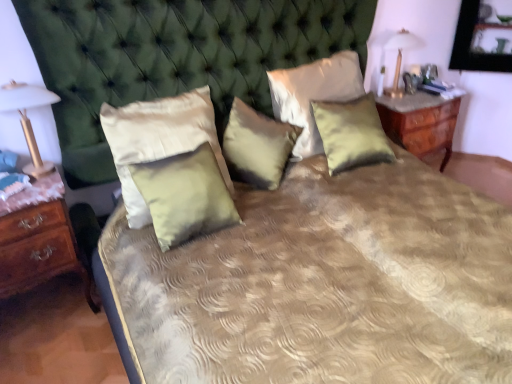
Measure the distance between point [25,167] and camera.

Point [25,167] is 1.88 meters from camera.

Describe the element at coordinates (185, 195) in the screenshot. I see `satin green pillow at center, placed as the 2th pillow when sorted from left to right` at that location.

Find the location of a particular element. satin green pillow at center, which is counted as the second pillow, starting from the right is located at coordinates (313, 94).

In order to click on satin yellow pillow at center, which appears as the 5th pillow when viewed from the left in this screenshot , I will do `click(351, 133)`.

Where is `wooden nightstand at right, marked as the 1th nightstand in a top-to-bottom arrangement`? This screenshot has height=384, width=512. wooden nightstand at right, marked as the 1th nightstand in a top-to-bottom arrangement is located at coordinates (420, 123).

Is gold metallic lampshade at left, the second bedside lamp when ordered from right to left, placed right next to gold metallic lampshade at upper right, which is counted as the second bedside lamp, starting from the bottom?

No, gold metallic lampshade at left, the second bedside lamp when ordered from right to left, is not touching gold metallic lampshade at upper right, which is counted as the second bedside lamp, starting from the bottom.

Considering the sizes of objects gold metallic lampshade at left, acting as the first bedside lamp starting from the left, and gold metallic lampshade at upper right, placed as the 2th bedside lamp when sorted from front to back, in the image provided, who is shorter, gold metallic lampshade at left, acting as the first bedside lamp starting from the left, or gold metallic lampshade at upper right, placed as the 2th bedside lamp when sorted from front to back,?

gold metallic lampshade at left, acting as the first bedside lamp starting from the left, is shorter.

From a real-world perspective, is gold metallic lampshade at left, which appears as the second bedside lamp when viewed from the back, over gold metallic lampshade at upper right, which is the 1th bedside lamp from top to bottom?

Indeed, from a real-world perspective, gold metallic lampshade at left, which appears as the second bedside lamp when viewed from the back, stands above gold metallic lampshade at upper right, which is the 1th bedside lamp from top to bottom.

Which object is positioned more to the right, gold metallic lampshade at left, acting as the 2th bedside lamp starting from the top, or gold metallic lampshade at upper right, placed as the 2th bedside lamp when sorted from front to back?

gold metallic lampshade at upper right, placed as the 2th bedside lamp when sorted from front to back, is more to the right.

Could you measure the distance between satin/velvet pillow at center, which ranks as the 5th pillow in right-to-left order, and gold metallic lampshade at left, marked as the first bedside lamp in a bottom-to-top arrangement?

The distance of satin/velvet pillow at center, which ranks as the 5th pillow in right-to-left order, from gold metallic lampshade at left, marked as the first bedside lamp in a bottom-to-top arrangement, is 16.63 inches.

Is point (138, 220) farther from camera compared to point (27, 173)?

That is True.

Is satin/velvet pillow at center, the 1th pillow when ordered from left to right, positioned behind gold metallic lampshade at left, the second bedside lamp when ordered from right to left?

Yes, satin/velvet pillow at center, the 1th pillow when ordered from left to right, is behind gold metallic lampshade at left, the second bedside lamp when ordered from right to left.

Where is `bedside lamp located on the left of satin/velvet pillow at center, the 1th pillow when ordered from left to right`? The width and height of the screenshot is (512, 384). bedside lamp located on the left of satin/velvet pillow at center, the 1th pillow when ordered from left to right is located at coordinates (28, 118).

This screenshot has width=512, height=384. In the image, there is a brown wood nightstand at left, which ranks as the second nightstand in right-to-left order. Identify the location of nightstand above it (from the image's perspective). (420, 123).

Considering the relative sizes of brown wood nightstand at left, positioned as the 1th nightstand in bottom-to-top order, and wooden nightstand at right, placed as the 2th nightstand when sorted from left to right, in the image provided, is brown wood nightstand at left, positioned as the 1th nightstand in bottom-to-top order, bigger than wooden nightstand at right, placed as the 2th nightstand when sorted from left to right,?

Actually, brown wood nightstand at left, positioned as the 1th nightstand in bottom-to-top order, might be smaller than wooden nightstand at right, placed as the 2th nightstand when sorted from left to right.

From the picture: Considering the sizes of objects brown wood nightstand at left, the 2th nightstand when ordered from back to front, and wooden nightstand at right, placed as the 2th nightstand when sorted from left to right, in the image provided, who is shorter, brown wood nightstand at left, the 2th nightstand when ordered from back to front, or wooden nightstand at right, placed as the 2th nightstand when sorted from left to right,?

With less height is wooden nightstand at right, placed as the 2th nightstand when sorted from left to right.

Is point (149, 222) more distant than point (319, 113)?

No, (149, 222) is closer to viewer.

Is there a large distance between satin/velvet pillow at center, which ranks as the 5th pillow in right-to-left order, and satin yellow pillow at center, the first pillow positioned from the right?

No, there isn't a large distance between satin/velvet pillow at center, which ranks as the 5th pillow in right-to-left order, and satin yellow pillow at center, the first pillow positioned from the right.

Considering the sizes of objects satin/velvet pillow at center, which ranks as the 5th pillow in right-to-left order, and satin yellow pillow at center, which appears as the 5th pillow when viewed from the left, in the image provided, who is shorter, satin/velvet pillow at center, which ranks as the 5th pillow in right-to-left order, or satin yellow pillow at center, which appears as the 5th pillow when viewed from the left,?

satin yellow pillow at center, which appears as the 5th pillow when viewed from the left.

Can you confirm if satin/velvet pillow at center, the 1th pillow when ordered from left to right, is positioned to the right of satin yellow pillow at center, which appears as the 5th pillow when viewed from the left?

In fact, satin/velvet pillow at center, the 1th pillow when ordered from left to right, is to the left of satin yellow pillow at center, which appears as the 5th pillow when viewed from the left.

In terms of width, does satin green pillow at center, which is counted as the second pillow, starting from the right, look wider or thinner when compared to gold metallic lampshade at upper right, which is the 1th bedside lamp from top to bottom?

In the image, satin green pillow at center, which is counted as the second pillow, starting from the right, appears to be wider than gold metallic lampshade at upper right, which is the 1th bedside lamp from top to bottom.

Considering the positions of point (345, 67) and point (396, 35), is point (345, 67) closer or farther from the camera than point (396, 35)?

Point (345, 67) is positioned closer to the camera compared to point (396, 35).

From the image's perspective, is satin green pillow at center, placed as the 4th pillow when sorted from left to right, above or below gold metallic lampshade at upper right, which is the 1th bedside lamp from top to bottom?

Clearly, from the image's perspective, satin green pillow at center, placed as the 4th pillow when sorted from left to right, is below gold metallic lampshade at upper right, which is the 1th bedside lamp from top to bottom.

From a real-world perspective, between satin green pillow at center, which is counted as the second pillow, starting from the right, and gold metallic lampshade at upper right, arranged as the 1th bedside lamp when viewed from the back, who is vertically higher?

gold metallic lampshade at upper right, arranged as the 1th bedside lamp when viewed from the back, from a real-world perspective.

From the image's perspective, is wooden nightstand at right, which ranks as the 1th nightstand in back-to-front order, above satin/velvet pillow at center, the 1th pillow when ordered from left to right?

Yes, from the image's perspective, wooden nightstand at right, which ranks as the 1th nightstand in back-to-front order, is on top of satin/velvet pillow at center, the 1th pillow when ordered from left to right.

Is wooden nightstand at right, arranged as the second nightstand when ordered from the bottom, directly adjacent to satin/velvet pillow at center, which ranks as the 5th pillow in right-to-left order?

No, wooden nightstand at right, arranged as the second nightstand when ordered from the bottom, is not next to satin/velvet pillow at center, which ranks as the 5th pillow in right-to-left order.

Relative to satin/velvet pillow at center, which ranks as the 5th pillow in right-to-left order, is wooden nightstand at right, marked as the 1th nightstand in a top-to-bottom arrangement, in front or behind?

In the image, wooden nightstand at right, marked as the 1th nightstand in a top-to-bottom arrangement, appears behind satin/velvet pillow at center, which ranks as the 5th pillow in right-to-left order.

Is wooden nightstand at right, the 1th nightstand positioned from the right, oriented towards satin/velvet pillow at center, the 1th pillow when ordered from left to right?

No, wooden nightstand at right, the 1th nightstand positioned from the right, is not oriented towards satin/velvet pillow at center, the 1th pillow when ordered from left to right.

Considering the relative sizes of satin green pillow at center, which is the 3th pillow in right-to-left order, and satin green pillow at center, placed as the 4th pillow when sorted from left to right, in the image provided, is satin green pillow at center, which is the 3th pillow in right-to-left order, thinner than satin green pillow at center, placed as the 4th pillow when sorted from left to right,?

Incorrect, the width of satin green pillow at center, which is the 3th pillow in right-to-left order, is not less than that of satin green pillow at center, placed as the 4th pillow when sorted from left to right.

Is point (266, 142) closer or farther from the camera than point (294, 107)?

Clearly, point (266, 142) is closer to the camera than point (294, 107).

How many degrees apart are the facing directions of satin green pillow at center, which is the 3th pillow in right-to-left order, and satin green pillow at center, placed as the 4th pillow when sorted from left to right?

36.2 degrees separate the facing orientations of satin green pillow at center, which is the 3th pillow in right-to-left order, and satin green pillow at center, placed as the 4th pillow when sorted from left to right.

From a real-world perspective, which pillow is the 3rd one underneath the satin green pillow at center, which is counted as the second pillow, starting from the right? Please provide its 2D coordinates.

[(257, 146)]

Image resolution: width=512 pixels, height=384 pixels. I want to click on bedside lamp that appears in front of the gold metallic lampshade at upper right, the 1th bedside lamp positioned from the right, so click(x=28, y=118).

You are a GUI agent. You are given a task and a screenshot of the screen. Output one action in this format:
    pyautogui.click(x=<x>, y=<y>)
    Task: Click on the 2nd pillow positioned below the gold metallic lampshade at left, acting as the 2th bedside lamp starting from the top (from a real-world perspective)
    The image size is (512, 384).
    Given the screenshot: What is the action you would take?
    pyautogui.click(x=158, y=139)

When comparing their distances from satin green pillow at center, acting as the 4th pillow starting from the right, does wooden nightstand at right, placed as the 2th nightstand when sorted from left to right, or satin green pillow at center, which is counted as the second pillow, starting from the right, seem further?

wooden nightstand at right, placed as the 2th nightstand when sorted from left to right.

Based on their spatial positions, is satin green pillow at center, which is the 3th pillow in right-to-left order, or gold metallic lampshade at left, the second bedside lamp when ordered from right to left, closer to satin yellow pillow at center, the first pillow positioned from the right?

satin green pillow at center, which is the 3th pillow in right-to-left order.

Based on the photo, estimate the real-world distances between objects in this image. Which object is closer to gold metallic lampshade at upper right, the 2th bedside lamp in the left-to-right sequence, satin green pillow at center, placed as the 4th pillow when sorted from left to right, or satin green pillow at center, acting as the 4th pillow starting from the right?

The object closer to gold metallic lampshade at upper right, the 2th bedside lamp in the left-to-right sequence, is satin green pillow at center, placed as the 4th pillow when sorted from left to right.

Looking at this image, looking at the image, which one is located closer to gold metallic lampshade at left, the second bedside lamp when ordered from right to left, satin yellow pillow at center, the first pillow positioned from the right, or wooden nightstand at right, positioned as the 2th nightstand in front-to-back order?

The object closer to gold metallic lampshade at left, the second bedside lamp when ordered from right to left, is satin yellow pillow at center, the first pillow positioned from the right.

Looking at the image, which one is located further to satin green pillow at center, which is counted as the second pillow, starting from the right, gold metallic lampshade at upper right, which is the 1th bedside lamp from top to bottom, or brown wood nightstand at left, which ranks as the second nightstand in right-to-left order?

brown wood nightstand at left, which ranks as the second nightstand in right-to-left order.

Estimate the real-world distances between objects in this image. Which object is further from gold metallic lampshade at left, the second bedside lamp when ordered from right to left, satin green pillow at center, placed as the 2th pillow when sorted from left to right, or wooden nightstand at right, marked as the 1th nightstand in a top-to-bottom arrangement?

wooden nightstand at right, marked as the 1th nightstand in a top-to-bottom arrangement, is positioned further to the anchor gold metallic lampshade at left, the second bedside lamp when ordered from right to left.

When comparing their distances from satin/velvet pillow at center, the 1th pillow when ordered from left to right, does satin green pillow at center, which is counted as the second pillow, starting from the right, or satin green pillow at center, which is the 3th pillow in right-to-left order, seem further?

satin green pillow at center, which is counted as the second pillow, starting from the right.

Estimate the real-world distances between objects in this image. Which object is further from satin yellow pillow at center, the first pillow positioned from the right, brown wood nightstand at left, which is the first nightstand in left-to-right order, or satin/velvet pillow at center, which ranks as the 5th pillow in right-to-left order?

brown wood nightstand at left, which is the first nightstand in left-to-right order, is further to satin yellow pillow at center, the first pillow positioned from the right.

Locate an element on the screen. The image size is (512, 384). bedside lamp situated between brown wood nightstand at left, the 2th nightstand when ordered from back to front, and satin green pillow at center, acting as the 4th pillow starting from the right, from left to right is located at coordinates (28, 118).

Image resolution: width=512 pixels, height=384 pixels. In order to click on pillow between satin green pillow at center, which is the 3th pillow in right-to-left order, and satin yellow pillow at center, which appears as the 5th pillow when viewed from the left, from left to right in this screenshot , I will do `click(313, 94)`.

Where is `pillow between brown wood nightstand at left, the 2th nightstand when ordered from back to front, and satin green pillow at center, placed as the 2th pillow when sorted from left to right, in the horizontal direction`? The width and height of the screenshot is (512, 384). pillow between brown wood nightstand at left, the 2th nightstand when ordered from back to front, and satin green pillow at center, placed as the 2th pillow when sorted from left to right, in the horizontal direction is located at coordinates pos(158,139).

Locate an element on the screen. The width and height of the screenshot is (512, 384). pillow between gold metallic lampshade at left, acting as the 2th bedside lamp starting from the top, and satin green pillow at center, acting as the 4th pillow starting from the right, from left to right is located at coordinates (158, 139).